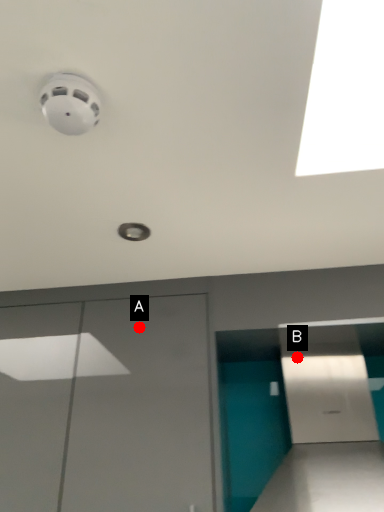
Question: Two points are circled on the image, labeled by A and B beside each circle. Which point appears closest to the camera in this image?

Choices:
 (A) A is closer
 (B) B is closer

Answer: (A)